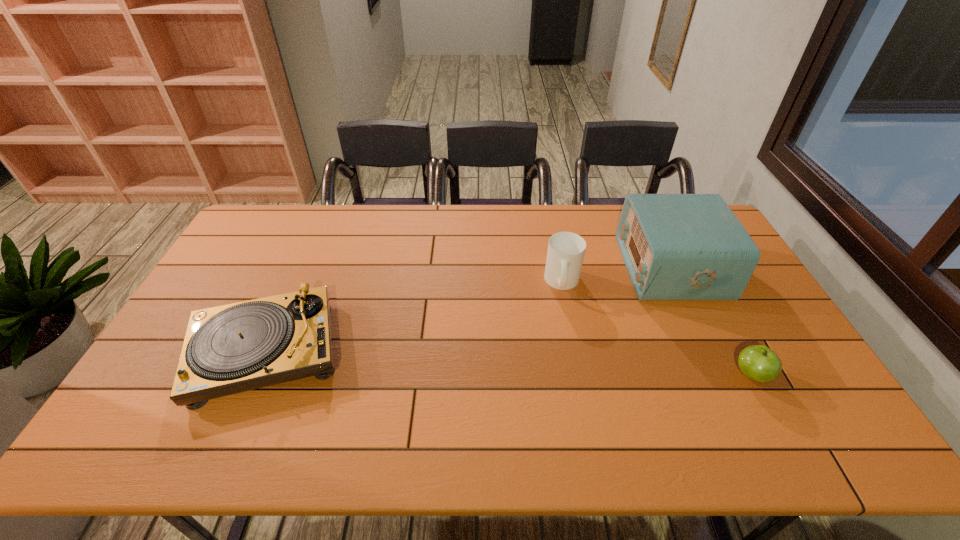
I want to click on vacant region between the apple and the second tallest object, so click(x=658, y=328).

This screenshot has width=960, height=540. Identify the location of vacant space that's between the tallest object and the apple. (711, 321).

The height and width of the screenshot is (540, 960). In order to click on empty space between the leftmost object and the tallest object in this screenshot , I will do `click(468, 309)`.

Find the location of a particular element. vacant area between the record player and the radio receiver is located at coordinates (468, 309).

This screenshot has width=960, height=540. Identify the location of free space between the second object from left to right and the record player. click(x=414, y=317).

The image size is (960, 540). Identify the location of free space between the tallest object and the record player. (468, 309).

Find the location of a particular element. The height and width of the screenshot is (540, 960). unoccupied area between the apple and the leftmost object is located at coordinates click(x=509, y=363).

You are a GUI agent. You are given a task and a screenshot of the screen. Output one action in this format:
    pyautogui.click(x=<x>, y=<y>)
    Task: Click on the vacant space that is in between the tallest object and the apple
    The width and height of the screenshot is (960, 540).
    Given the screenshot: What is the action you would take?
    pyautogui.click(x=711, y=321)

The image size is (960, 540). I want to click on free spot between the radio receiver and the second object from left to right, so click(x=616, y=275).

Find the location of a particular element. free space between the apple and the leftmost object is located at coordinates (509, 363).